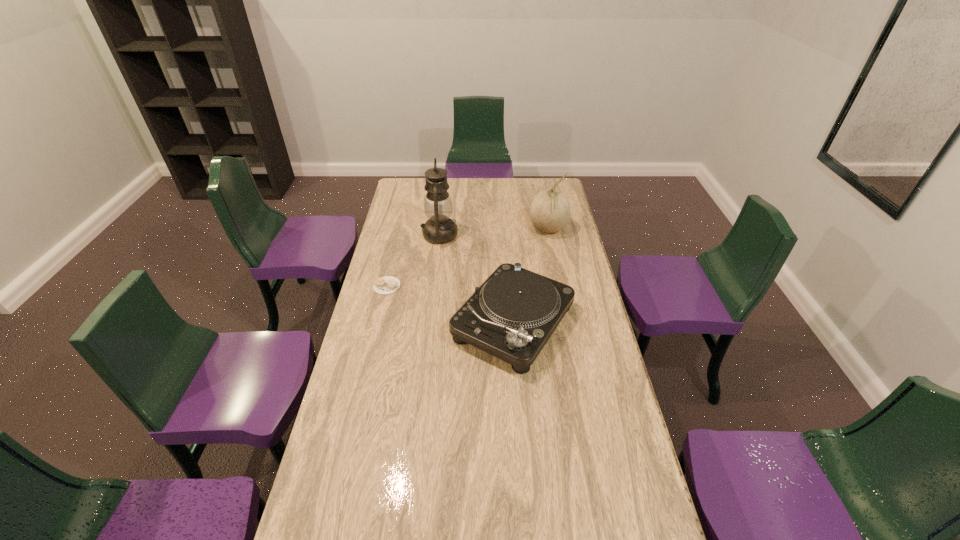
The height and width of the screenshot is (540, 960). What are the coordinates of `vacant point located between the second tallest object and the shortest object` in the screenshot? It's located at (468, 258).

Identify the location of vacant space that is in between the third tallest object and the oil lamp. (476, 279).

Locate an element on the screen. The width and height of the screenshot is (960, 540). vacant area between the tallest object and the record player is located at coordinates (476, 279).

Find the location of a particular element. The width and height of the screenshot is (960, 540). empty space that is in between the second tallest object and the oil lamp is located at coordinates (493, 232).

Identify the location of free space between the shortest object and the record player. 450,305.

Identify which object is the second nearest to the second shortest object. Please provide its 2D coordinates. Your answer should be formatted as a tuple, i.e. [(x, y)], where the tuple contains the x and y coordinates of a point satisfying the conditions above.

[(385, 285)]

Select which object appears as the closest to the oil lamp. Please provide its 2D coordinates. Your answer should be formatted as a tuple, i.e. [(x, y)], where the tuple contains the x and y coordinates of a point satisfying the conditions above.

[(385, 285)]